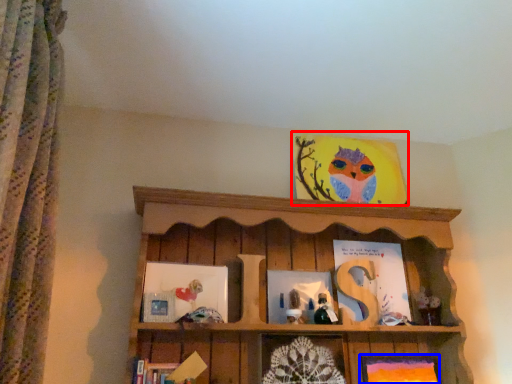
Question: Which object is closer to the camera taking this photo, picture frame (highlighted by a red box) or picture frame (highlighted by a blue box)?

Choices:
 (A) picture frame
 (B) picture frame

Answer: (B)